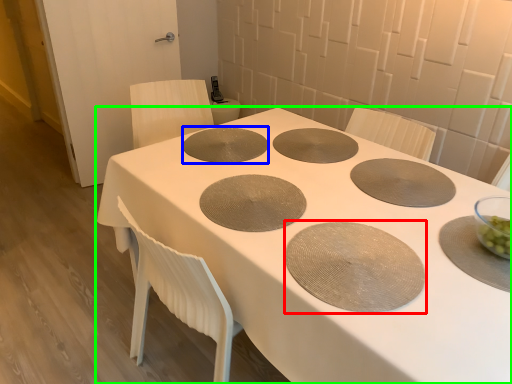
Question: Which object is the closest to the oval (highlighted by a red box)? Choose among these: oval (highlighted by a blue box) or table (highlighted by a green box).

Choices:
 (A) oval
 (B) table

Answer: (B)